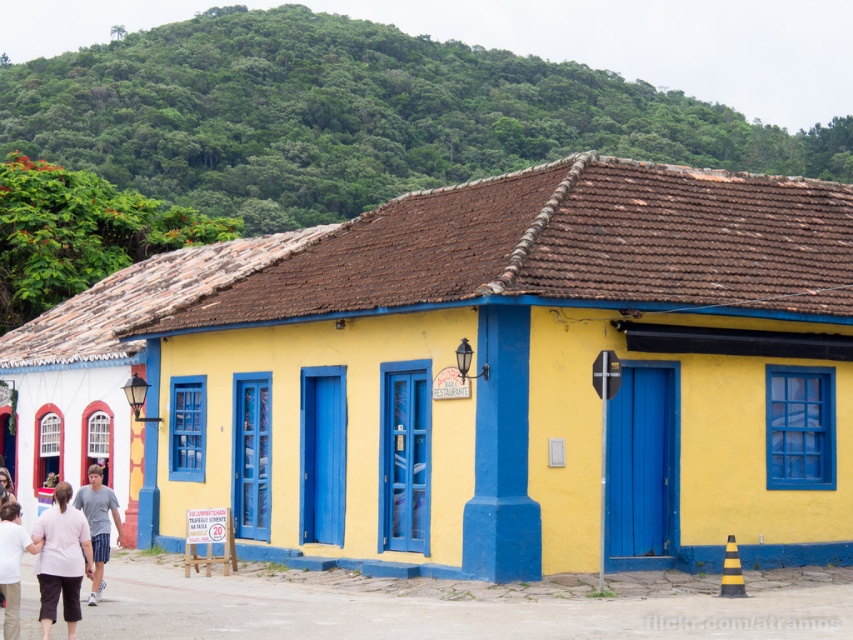
Question: Is yellow matte building at center positioned behind green leafy hillside at upper center?

Choices:
 (A) no
 (B) yes

Answer: (A)

Question: Where is yellow matte building at center located in relation to pink fabric pants at lower left in the image?

Choices:
 (A) below
 (B) above

Answer: (B)

Question: Which point is closer to the camera taking this photo?

Choices:
 (A) (450, 282)
 (B) (78, 618)
 (C) (15, 621)
 (D) (115, 506)

Answer: (C)

Question: Considering the real-world distances, which object is farthest from the green leafy hillside at upper center?

Choices:
 (A) yellow matte building at center
 (B) pink fabric pants at lower left
 (C) white cotton shirt at lower left
 (D) gray cotton shirt at lower left

Answer: (B)

Question: Which of the following is the farthest from the observer?

Choices:
 (A) yellow matte building at center
 (B) gray cotton shirt at lower left
 (C) pink fabric pants at lower left
 (D) green leafy hillside at upper center

Answer: (D)

Question: Can you confirm if pink fabric pants at lower left is positioned below white cotton shirt at lower left?

Choices:
 (A) no
 (B) yes

Answer: (A)